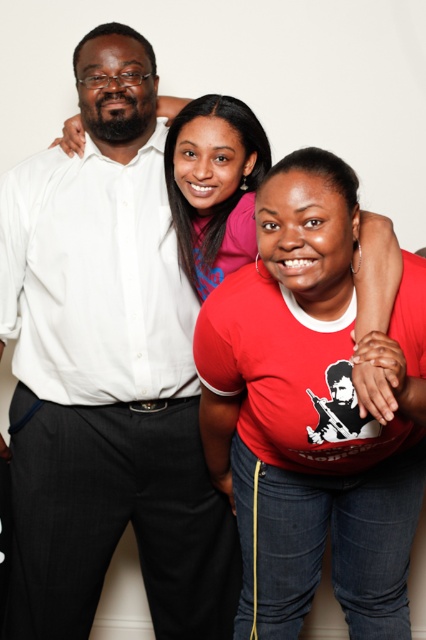
Question: Is white shirt at center bigger than red matte t-shirt at center?

Choices:
 (A) yes
 (B) no

Answer: (B)

Question: Which of the following is the closest to the observer?

Choices:
 (A) pos(296,556)
 (B) pos(144,109)

Answer: (A)

Question: Which of the following is the closest to the observer?

Choices:
 (A) (86, 205)
 (B) (282, 362)

Answer: (B)

Question: Which of the following is the farthest from the observer?

Choices:
 (A) red matte t-shirt at center
 (B) white shirt at center

Answer: (B)

Question: Does white shirt at center have a smaller size compared to red matte t-shirt at center?

Choices:
 (A) no
 (B) yes

Answer: (B)

Question: Does white shirt at center have a larger size compared to red matte t-shirt at center?

Choices:
 (A) yes
 (B) no

Answer: (B)